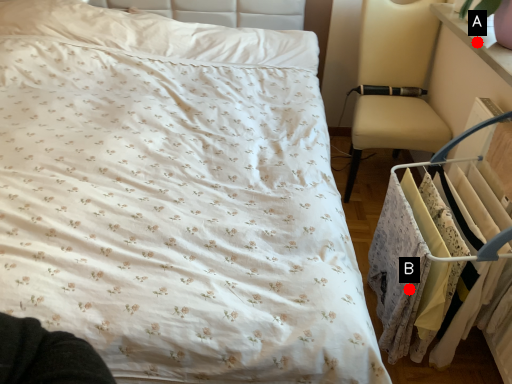
Question: Two points are circled on the image, labeled by A and B beside each circle. Which point is farther to the camera?

Choices:
 (A) A is further
 (B) B is further

Answer: (A)